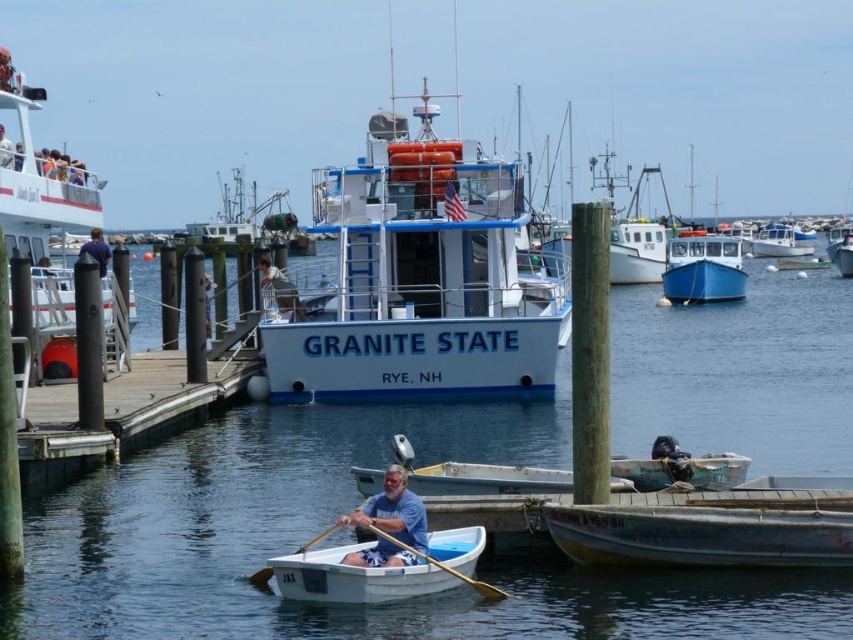
You are planning to transport a large piece of equipment that requires a wider vessel. Based on the scene, which object between the white plastic boat at left and the white matte canoe at lower center would be more suitable for your needs?

The white plastic boat at left is wider than the white matte canoe at lower center, making it more suitable for transporting large equipment requiring a wider vessel.